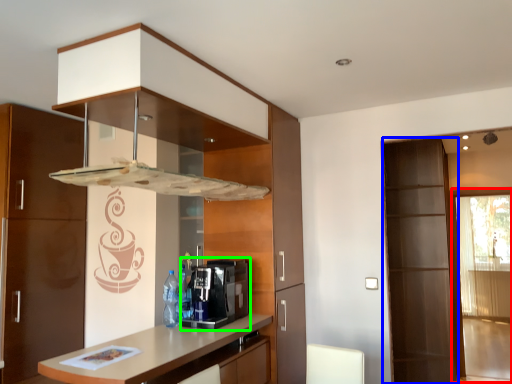
Question: Based on their relative distances, which object is farther from screen door (highlighted by a red box)? Choose from screen door (highlighted by a blue box) and coffee machine (highlighted by a green box).

Choices:
 (A) screen door
 (B) coffee machine

Answer: (B)